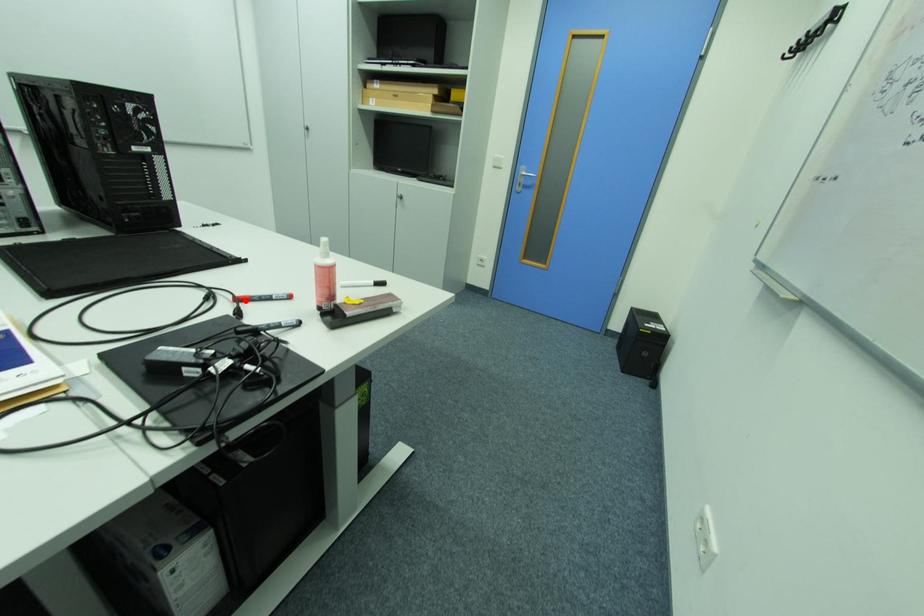
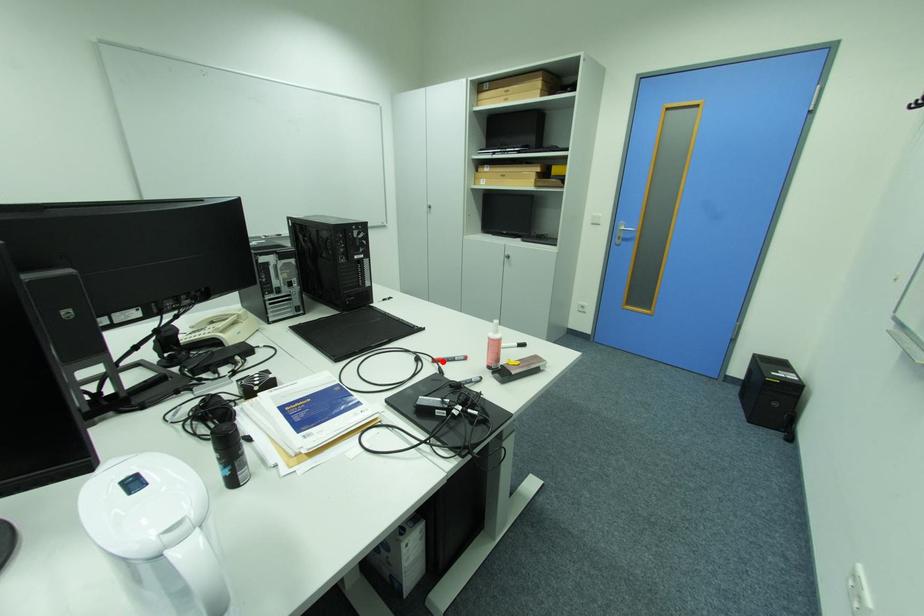
I am providing you with two images of the same scene from different viewpoints. A red point is marked on the first image and another point is marked on the second image. Is the red point in image1 aligned with the point shown in image2?

Yes